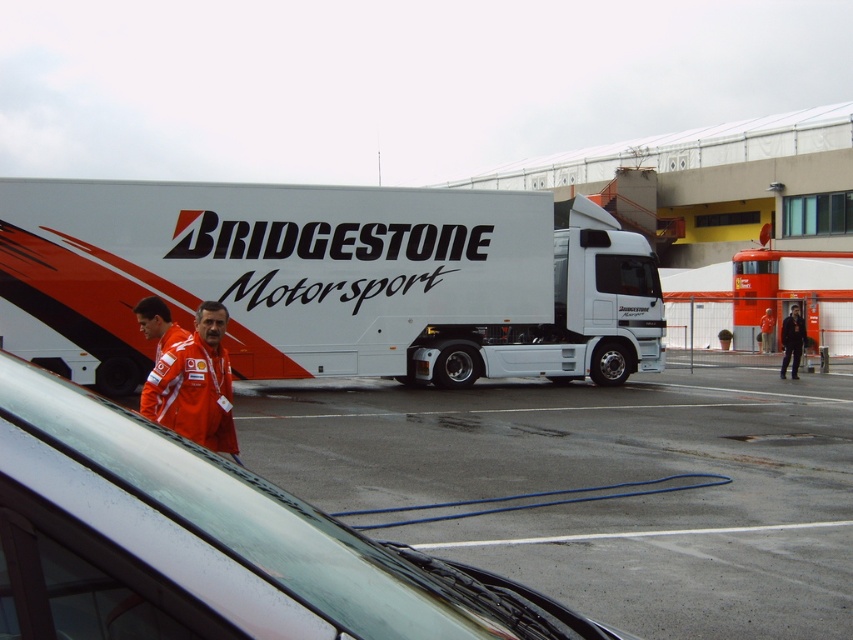
You are a photographer at the Bridgestone Motorsport event. You need to capture a photo where both the orange fabric jacket at lower center and the black leather jacket at center are visible. Which jacket will appear larger in the photo?

The orange fabric jacket at lower center is shorter than the black leather jacket at center, so the black leather jacket at center will appear larger in the photo.

You are a photographer positioned at the center of the scene. You want to capture a photo that includes both the orange fabric jacket at lower center and the Bridgestone Motorsport truck. Based on their positions, which object is closer to your current position?

The orange fabric jacket at lower center is closer to your current position because it is located at point (195,385), which is nearer to the center compared to the truck.

You are a photographer at the event and need to capture a photo that includes both the orange fabric jacket at lower center and the black leather jacket at center. Given that your camera has a maximum focus range of 20 meters, will you be able to include both in the same frame without moving the camera?

The orange fabric jacket at lower center and black leather jacket at center are 20.71 meters apart from each other, which exceeds the camera maximum focus range of 20 meters. Therefore, you cannot include both in the same frame without moving the camera.